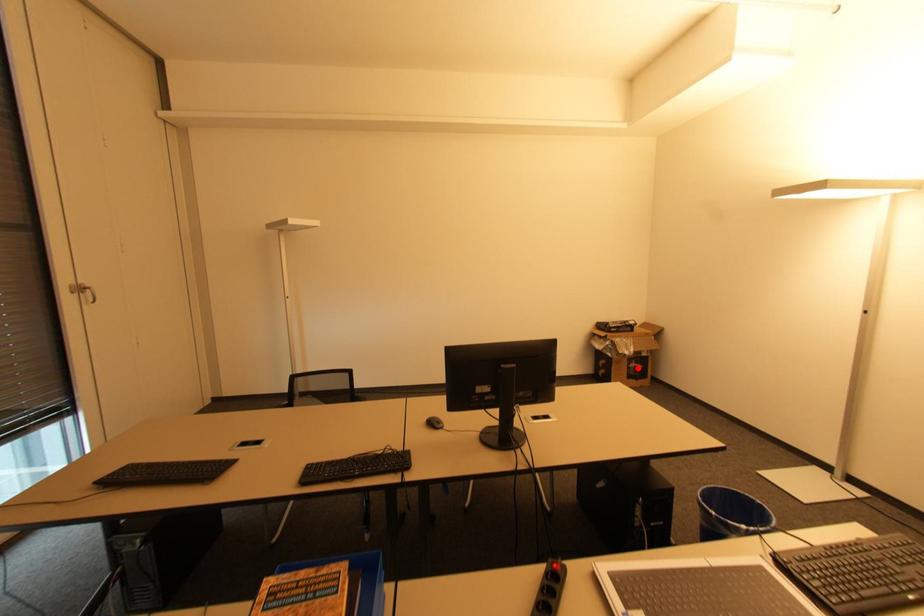
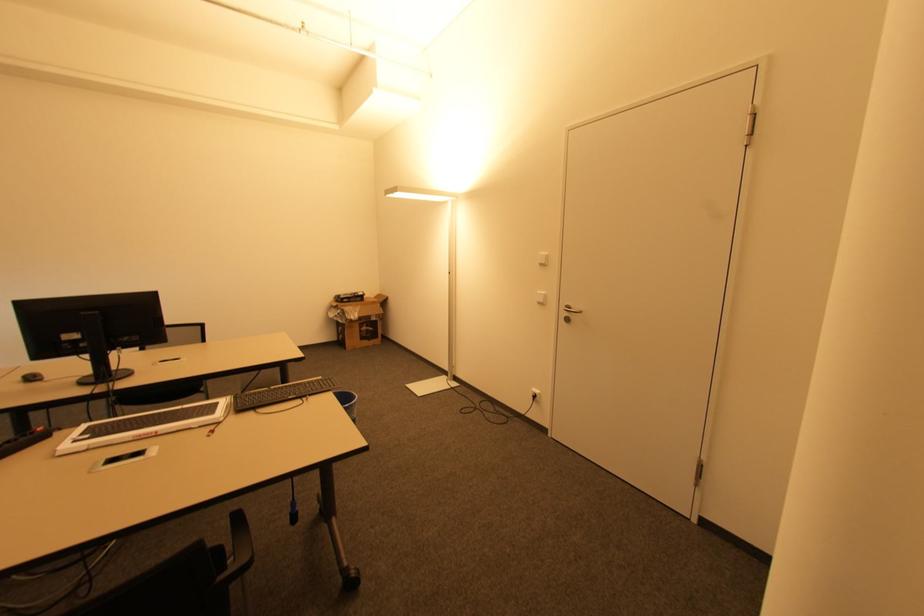
Where in the second image is the point corresponding to the highlighted location from the first image?

(369, 331)